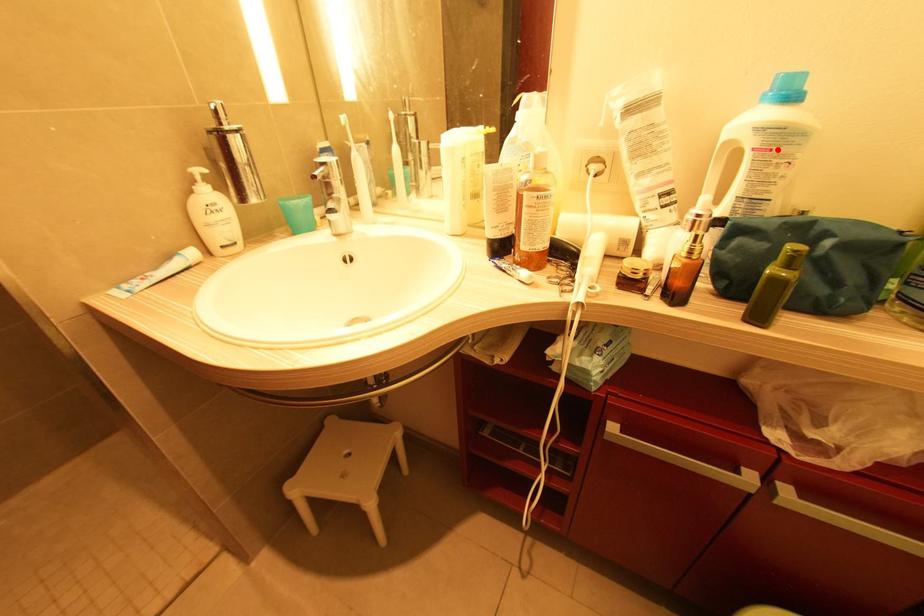
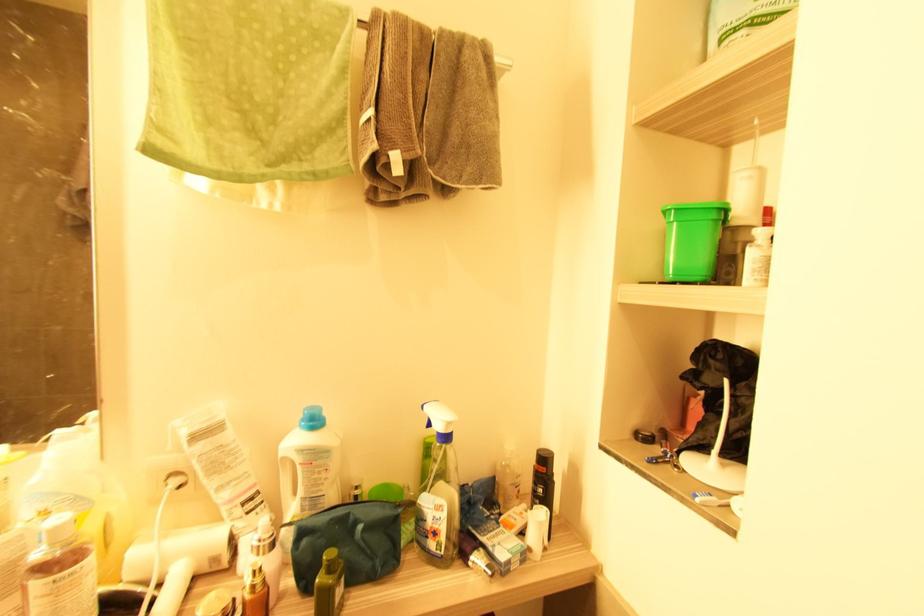
Question: I am providing you with two images of the same scene from different viewpoints. A red point is marked on the first image. At the location where the point appears in image 1, is it still visible in image 2?

Choices:
 (A) Yes
 (B) No

Answer: (A)